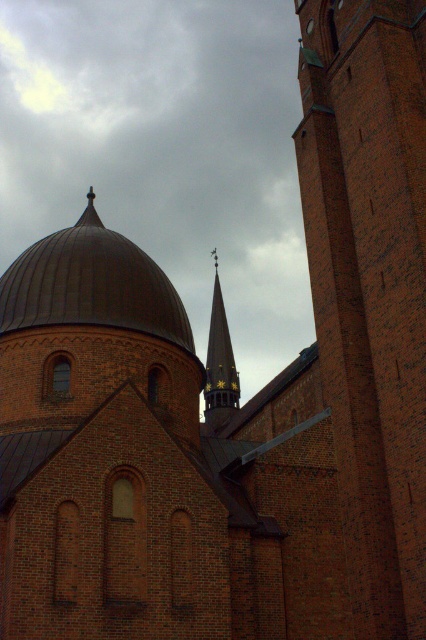
Question: Based on their relative distances, which object is nearer to the dark brown metallic dome at center?

Choices:
 (A) goldmetallicspire at upper center
 (B) brick tower at right

Answer: (B)

Question: Can you confirm if dark brown metallic dome at center is smaller than goldmetallicspire at upper center?

Choices:
 (A) yes
 (B) no

Answer: (A)

Question: Which point appears closest to the camera in this image?

Choices:
 (A) (45, 250)
 (B) (374, 300)
 (C) (222, 342)

Answer: (B)

Question: Is brick tower at right thinner than dark brown metallic dome at center?

Choices:
 (A) no
 (B) yes

Answer: (B)

Question: Which point is farther to the camera?

Choices:
 (A) (377, 566)
 (B) (224, 358)

Answer: (B)

Question: Does brick tower at right come in front of goldmetallicspire at upper center?

Choices:
 (A) no
 (B) yes

Answer: (B)